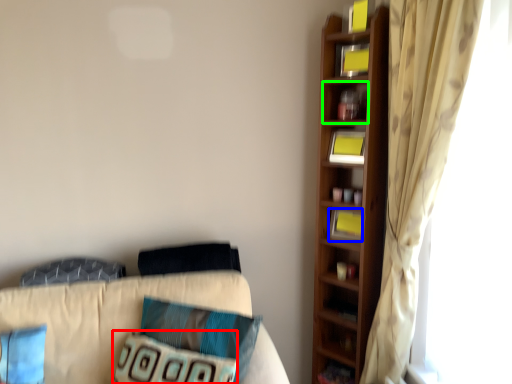
Question: Considering the real-world distances, which object is farthest from pillow (highlighted by a red box)? book (highlighted by a blue box) or cabinet (highlighted by a green box)?

Choices:
 (A) book
 (B) cabinet

Answer: (B)